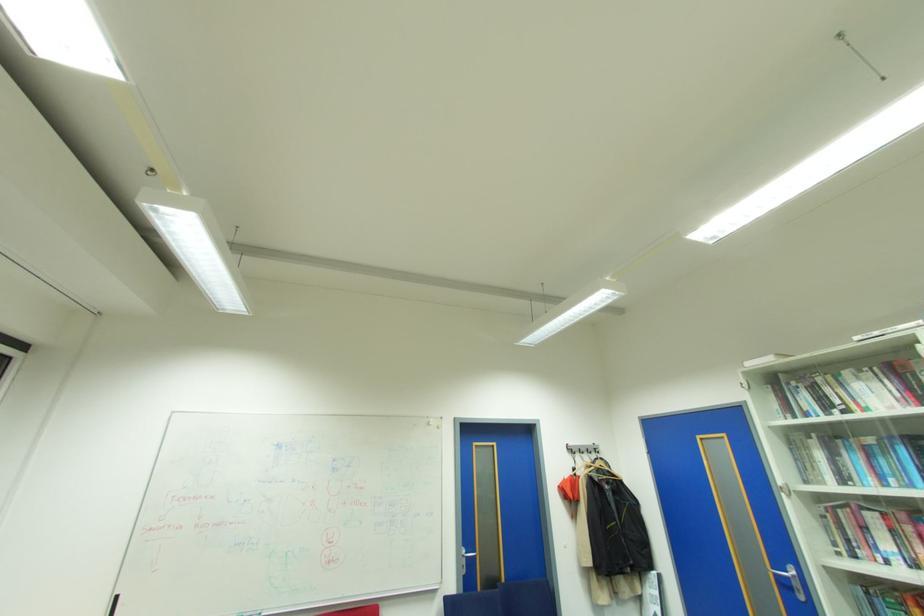
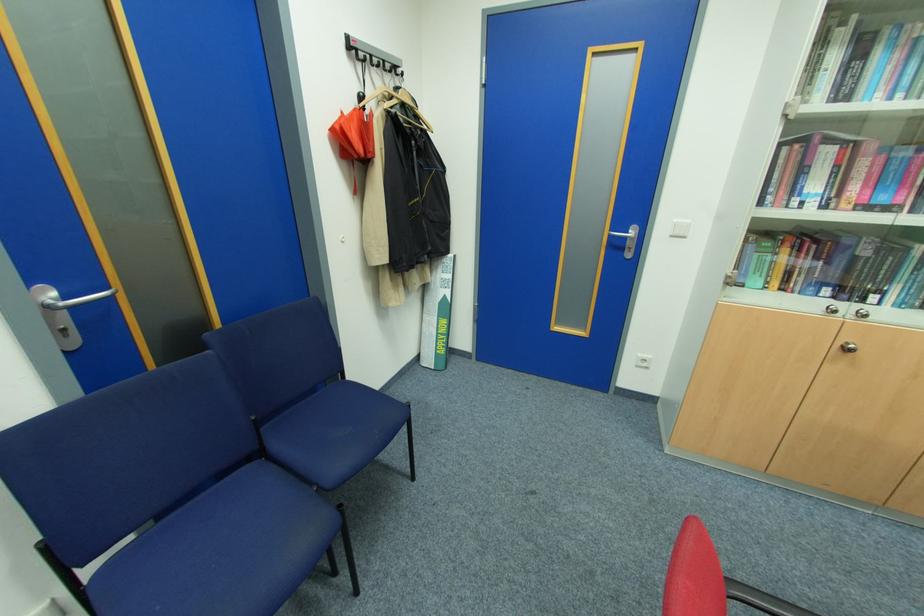
The point at (480,553) is marked in the first image. Where is the corresponding point in the second image?

(113, 288)